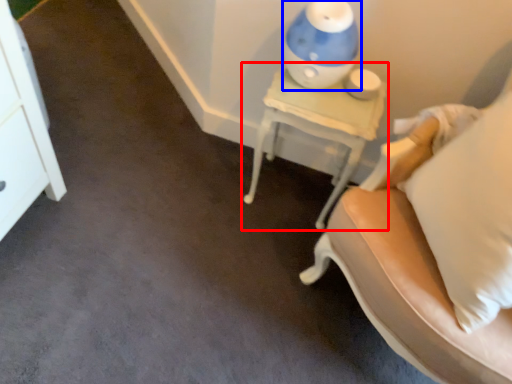
Question: Among these objects, which one is farthest to the camera, nightstand (highlighted by a red box) or table lamp (highlighted by a blue box)?

Choices:
 (A) nightstand
 (B) table lamp

Answer: (A)